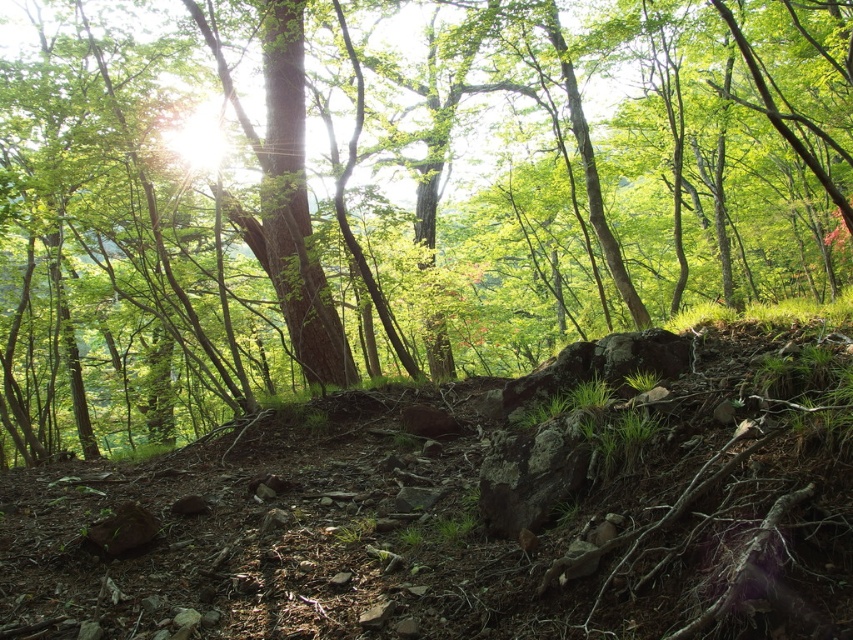
Question: Which point is closer to the camera taking this photo?

Choices:
 (A) (582, 611)
 (B) (670, 173)

Answer: (A)

Question: Is green matte tree at center in front of dull brown dirt at center?

Choices:
 (A) no
 (B) yes

Answer: (A)

Question: Can you confirm if green matte tree at center is positioned to the right of dull brown dirt at center?

Choices:
 (A) yes
 (B) no

Answer: (B)

Question: Which point is farther to the camera?

Choices:
 (A) dull brown dirt at center
 (B) green matte tree at center

Answer: (B)

Question: Which point is closer to the camera taking this photo?

Choices:
 (A) (212, 593)
 (B) (741, 212)

Answer: (A)

Question: Can you confirm if green matte tree at center is positioned below dull brown dirt at center?

Choices:
 (A) no
 (B) yes

Answer: (A)